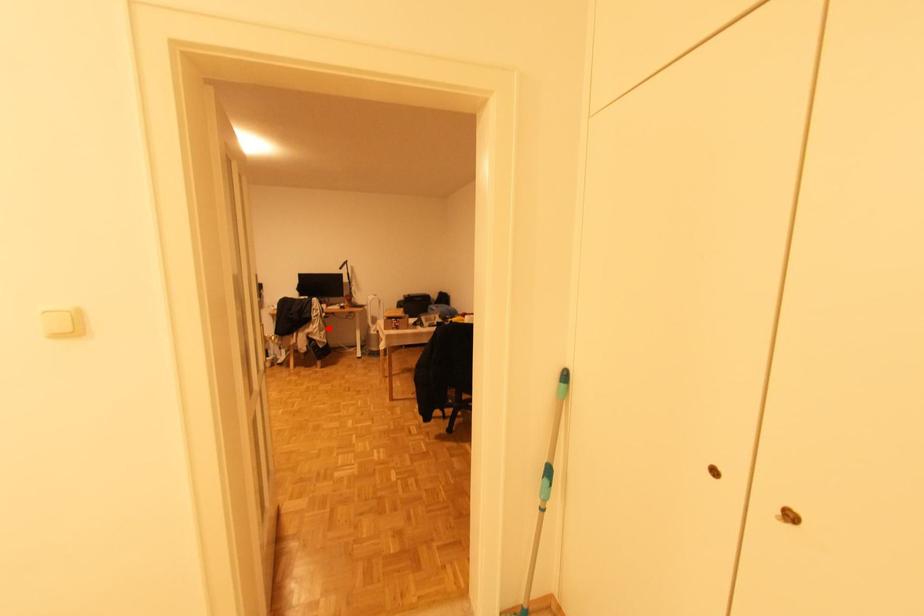
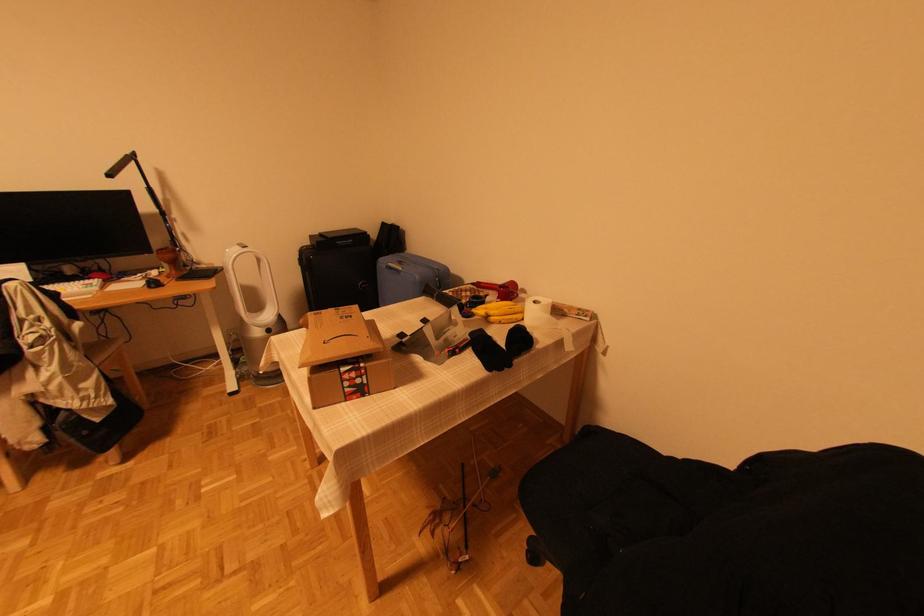
Question: I am providing you with two images of the same scene from different viewpoints. A red point is shown in image1. For the corresponding object point in image2, is it positioned nearer or farther from the camera?

Choices:
 (A) Nearer
 (B) Farther

Answer: (B)